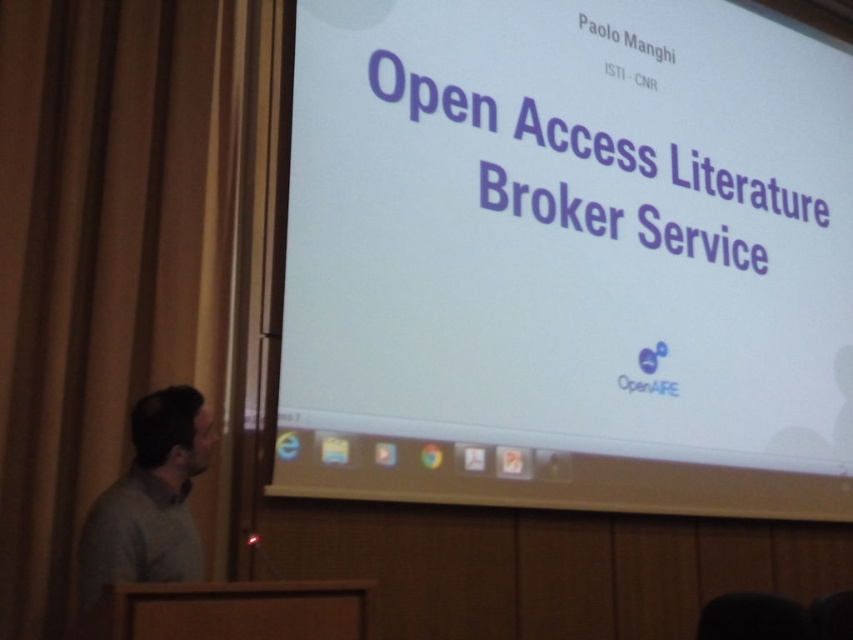
You are an attendee at the presentation and want to see the presenter clearly. Since the presenter is wearing a gray sweater at left, can you see them standing behind the white matte projection screen at center?

The gray sweater at left is behind the white matte projection screen at center, so the presenter wearing the gray sweater at left would be obscured by the screen, making it difficult to see them clearly from the audience side.

You are an attendee at the presentation and want to take a photo of the screen and the presenter. Since your camera has a limited field of view, you need to ensure both the white matte projection screen at center and the gray sweater at left are fully visible in the frame. Based on their sizes, can you determine which object is wider and thus requires more space in the photo?

The white matte projection screen at center is wider than the gray sweater at left, so it requires more space in the photo to be fully visible.